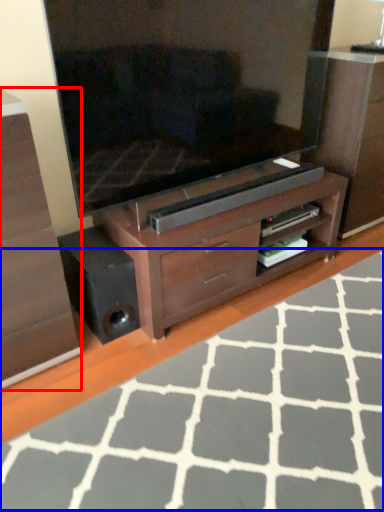
Question: Which point is closer to the camera, chest of drawers (highlighted by a red box) or plain (highlighted by a blue box)?

Choices:
 (A) chest of drawers
 (B) plain

Answer: (B)